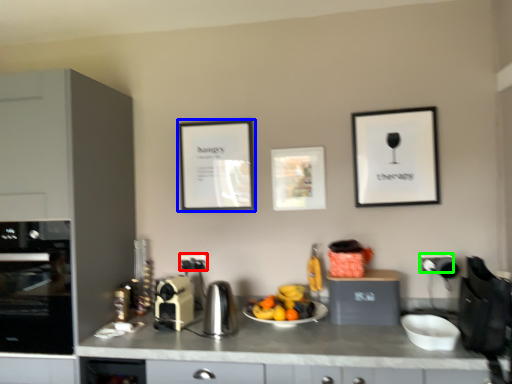
Question: Which object is positioned farthest from electric outlet (highlighted by a red box)? Select from picture frame (highlighted by a blue box) and electric outlet (highlighted by a green box).

Choices:
 (A) picture frame
 (B) electric outlet

Answer: (B)